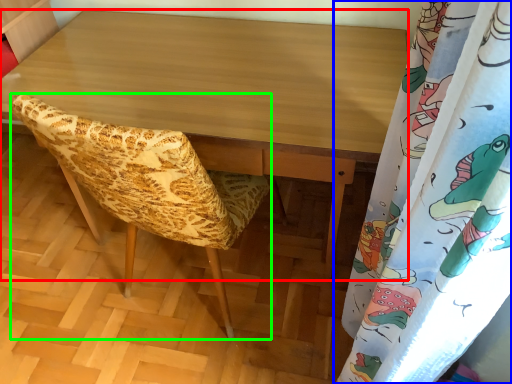
Question: Which is nearer to the desk (highlighted by a red box)? curtain (highlighted by a blue box) or furniture (highlighted by a green box).

Choices:
 (A) curtain
 (B) furniture

Answer: (B)